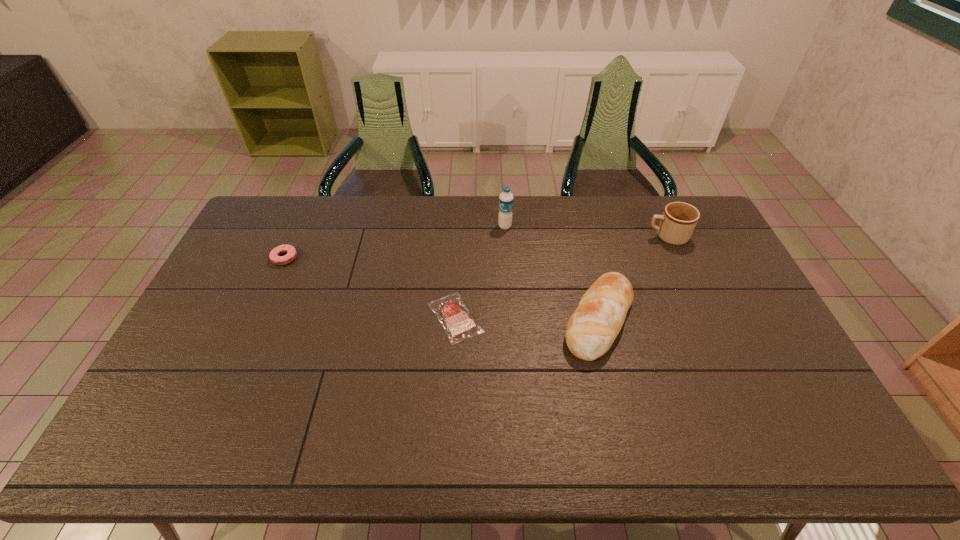
You are a GUI agent. You are given a task and a screenshot of the screen. Output one action in this format:
    pyautogui.click(x=<x>, y=<y>)
    Task: Click on the vacant area in the image that satisfies the following two spatial constraints: 1. on the back side of the bread; 2. on the label of the water bottle
    This screenshot has height=540, width=960.
    Given the screenshot: What is the action you would take?
    pyautogui.click(x=577, y=226)

Where is `free point that satisfies the following two spatial constraints: 1. on the label of the third object from right to left; 2. on the right side of the bread`? This screenshot has width=960, height=540. free point that satisfies the following two spatial constraints: 1. on the label of the third object from right to left; 2. on the right side of the bread is located at coordinates (511, 320).

Where is `free point that satisfies the following two spatial constraints: 1. on the label of the bread; 2. on the left side of the tallest object`? free point that satisfies the following two spatial constraints: 1. on the label of the bread; 2. on the left side of the tallest object is located at coordinates coord(511,320).

Locate an element on the screen. vacant region that satisfies the following two spatial constraints: 1. on the label of the tallest object; 2. on the right side of the fourth object from left to right is located at coordinates (511, 320).

At what (x,y) coordinates should I click in order to perform the action: click on vacant point that satisfies the following two spatial constraints: 1. on the back side of the doughnut; 2. on the side of the rightmost object with the handle. Please return your answer as a coordinate pair (x, y). This screenshot has height=540, width=960. Looking at the image, I should click on (295, 237).